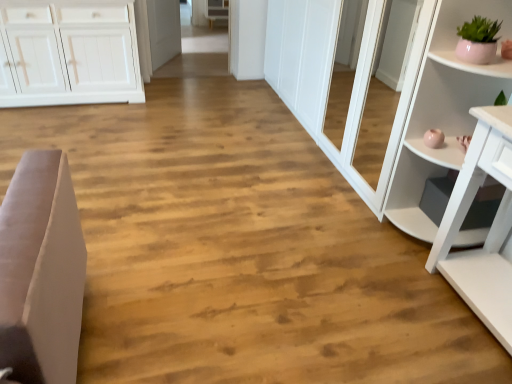
Question: Does matte pink pot at upper right have a greater height compared to white glossy door at center?

Choices:
 (A) yes
 (B) no

Answer: (B)

Question: Does matte pink pot at upper right have a lesser height compared to white glossy door at center?

Choices:
 (A) no
 (B) yes

Answer: (B)

Question: Is matte pink pot at upper right surrounding white glossy door at center?

Choices:
 (A) no
 (B) yes

Answer: (A)

Question: Is matte pink pot at upper right far from white glossy door at center?

Choices:
 (A) no
 (B) yes

Answer: (B)

Question: Considering the relative positions of matte pink pot at upper right and white glossy door at center in the image provided, is matte pink pot at upper right to the left of white glossy door at center from the viewer's perspective?

Choices:
 (A) no
 (B) yes

Answer: (A)

Question: Is matte pink pot at upper right to the right of white glossy door at center from the viewer's perspective?

Choices:
 (A) no
 (B) yes

Answer: (B)

Question: From the image's perspective, is white glossy shelf at right below white wood cabinet at upper center?

Choices:
 (A) yes
 (B) no

Answer: (A)

Question: Is white glossy shelf at right shorter than white wood cabinet at upper center?

Choices:
 (A) no
 (B) yes

Answer: (A)

Question: From the image's perspective, is white glossy shelf at right over white wood cabinet at upper center?

Choices:
 (A) yes
 (B) no

Answer: (B)

Question: Can you confirm if white glossy shelf at right is bigger than white wood cabinet at upper center?

Choices:
 (A) yes
 (B) no

Answer: (A)

Question: Would you consider white glossy shelf at right to be distant from white wood cabinet at upper center?

Choices:
 (A) no
 (B) yes

Answer: (B)

Question: Is white glossy shelf at right oriented towards white wood cabinet at upper center?

Choices:
 (A) no
 (B) yes

Answer: (A)

Question: From a real-world perspective, is matte pink pot at upper right located higher than white glossy shelf at right?

Choices:
 (A) yes
 (B) no

Answer: (A)